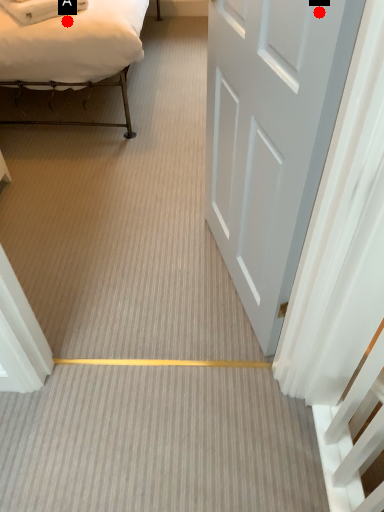
Question: Two points are circled on the image, labeled by A and B beside each circle. Which point is farther from the camera taking this photo?

Choices:
 (A) A is further
 (B) B is further

Answer: (A)